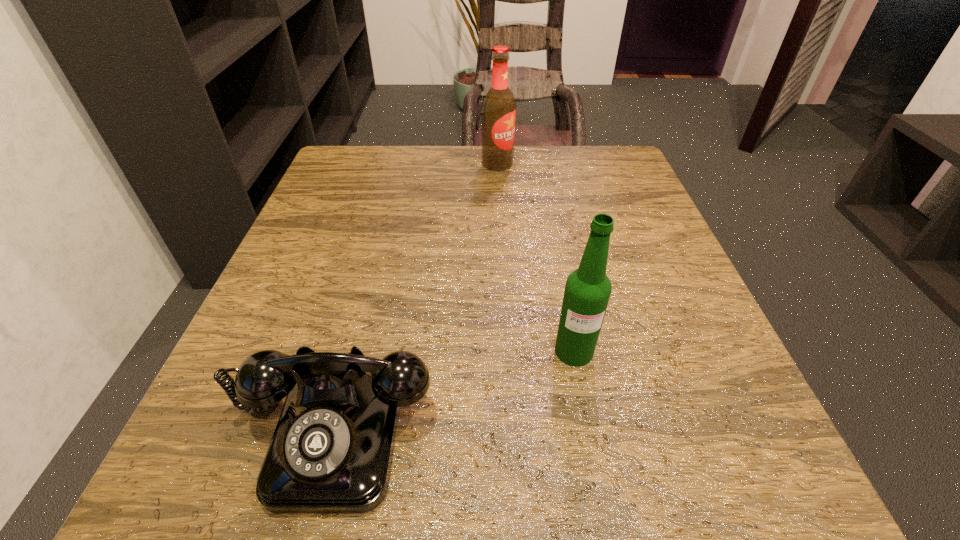
Locate an element on the screen. object located at the left edge is located at coordinates (x=331, y=452).

Locate an element on the screen. object positioned at the near left corner is located at coordinates (331, 452).

This screenshot has width=960, height=540. What are the coordinates of `vacant space at the far edge of the desktop` in the screenshot? It's located at (549, 180).

In order to click on vacant space at the near edge of the desktop in this screenshot , I will do `click(558, 460)`.

At what (x,y) coordinates should I click in order to perform the action: click on vacant space at the left edge of the desktop. Please return your answer as a coordinate pair (x, y). The height and width of the screenshot is (540, 960). Looking at the image, I should click on (362, 240).

You are a GUI agent. You are given a task and a screenshot of the screen. Output one action in this format:
    pyautogui.click(x=<x>, y=<y>)
    Task: Click on the free space at the right edge of the desktop
    This screenshot has width=960, height=540.
    Given the screenshot: What is the action you would take?
    pyautogui.click(x=683, y=305)

Locate an element on the screen. The height and width of the screenshot is (540, 960). vacant space at the far left corner of the desktop is located at coordinates (347, 164).

Find the location of a particular element. blank area at the far right corner is located at coordinates (609, 195).

Where is `vacant space at the near right corner of the desktop`? vacant space at the near right corner of the desktop is located at coordinates (666, 500).

Identify the location of empty location between the nearer beer bottle and the left beer bottle. This screenshot has width=960, height=540. (536, 258).